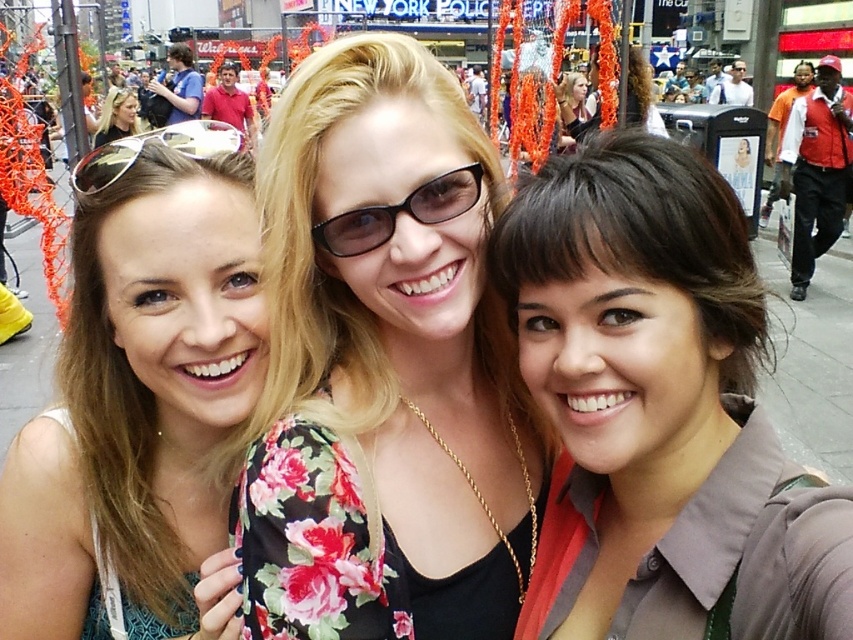
You are a photographer standing 2 meters away from the two subjects in the scene, the brown hair at center and the floral fabric dress at center. You want to capture a photo that includes both of them without moving your position. Is it possible to frame both subjects in a single shot if your camera has a standard 50mm lens with a field of view of 46 degrees?

The brown hair at center and floral fabric dress at center are 1.60 meters apart. Since the photographer is 2 meters away and the subjects are 1.60 meters apart, the angle between them can be calculated using trigonometry. The maximum angle covered by the camera is 46 degrees. The angle between the two subjects would be arctangent of 1.60 divided by 2, which is approximately 41 degrees. Since 41 degrees is less than 46 degrees, the camera can capture both subjects in one shot.

You are a photographer trying to capture a clear shot of the floral fabric dress at center and the matte black sunglasses at center. Which object is closer to the camera?

The floral fabric dress at center is closer to the camera than the matte black sunglasses at center.